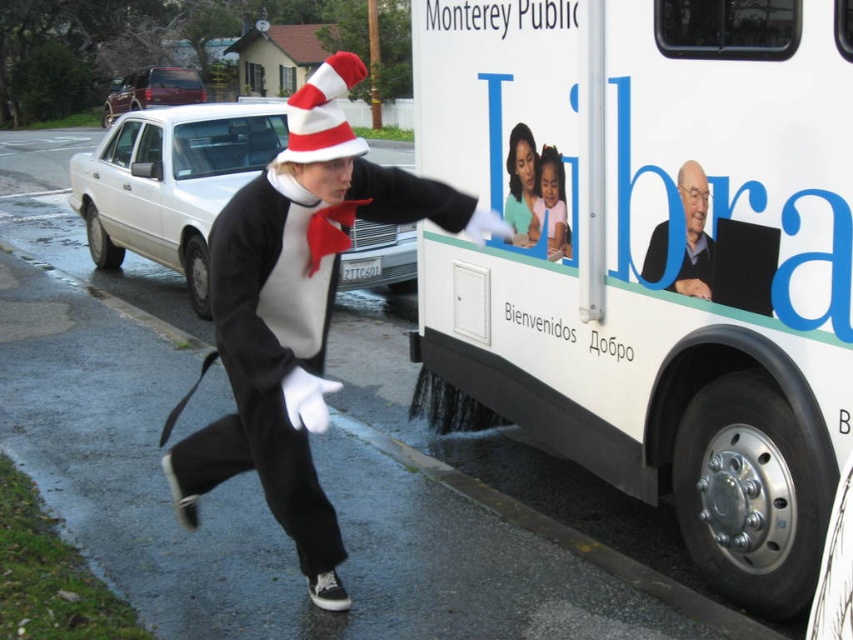
How far apart are white matte bus at right and smooth skin woman at upper center?

The distance of white matte bus at right from smooth skin woman at upper center is 20.06 inches.

Is white matte bus at right smaller than smooth skin woman at upper center?

No, white matte bus at right is not smaller than smooth skin woman at upper center.

Find the location of a particular element. white matte bus at right is located at coordinates (666, 259).

This screenshot has width=853, height=640. Identify the location of white matte bus at right. (666, 259).

Measure the distance from matte black costume at center to gray hair man at upper right.

matte black costume at center is 1.59 meters from gray hair man at upper right.

Is point (190, 448) closer to viewer compared to point (645, 276)?

Yes, point (190, 448) is in front of point (645, 276).

Does point (281, 436) come in front of point (700, 220)?

Yes, it is in front of point (700, 220).

Find the location of `matte black costume at center`. matte black costume at center is located at coordinates (297, 310).

Is red striped fabric hat at center closer to camera compared to pastel pink fabric at center?

Yes, red striped fabric hat at center is closer to the viewer.

Which is in front, point (343, 52) or point (537, 228)?

Positioned in front is point (537, 228).

Find the location of `red striped fabric hat at center`. red striped fabric hat at center is located at coordinates (323, 113).